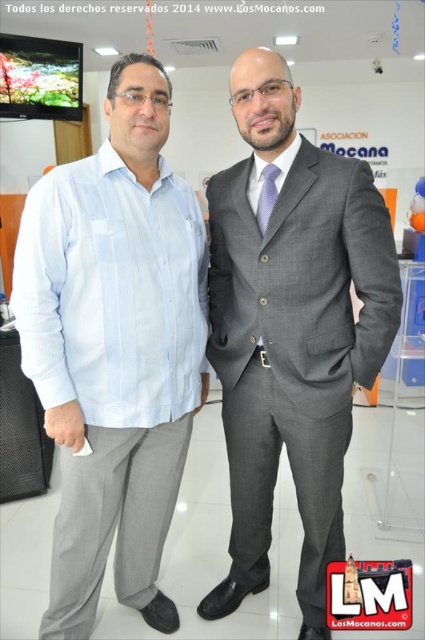
You are a photographer setting up for a group photo. You need to position a spotlight at point (291, 330) to highlight an object in the scene. Which object should you direct the spotlight towards?

The gray wool suit at center is located at point (291, 330), so you should direct the spotlight towards the gray wool suit at center.